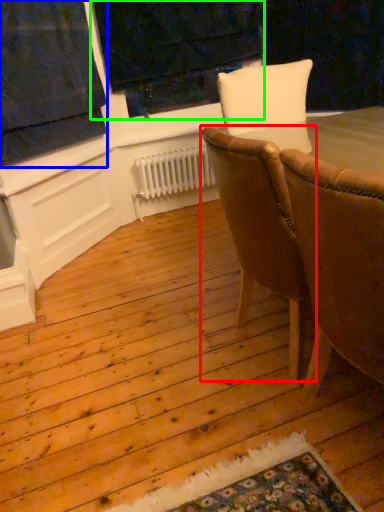
Question: Which object is the closest to the chair (highlighted by a red box)? Choose among these: curtain (highlighted by a blue box) or window frame (highlighted by a green box).

Choices:
 (A) curtain
 (B) window frame

Answer: (A)